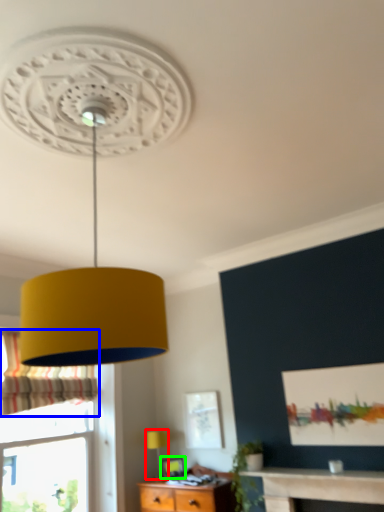
Question: Which object is positioned farthest from table lamp (highlighted by a red box)? Select from curtain (highlighted by a blue box) and picture frame (highlighted by a green box).

Choices:
 (A) curtain
 (B) picture frame

Answer: (A)